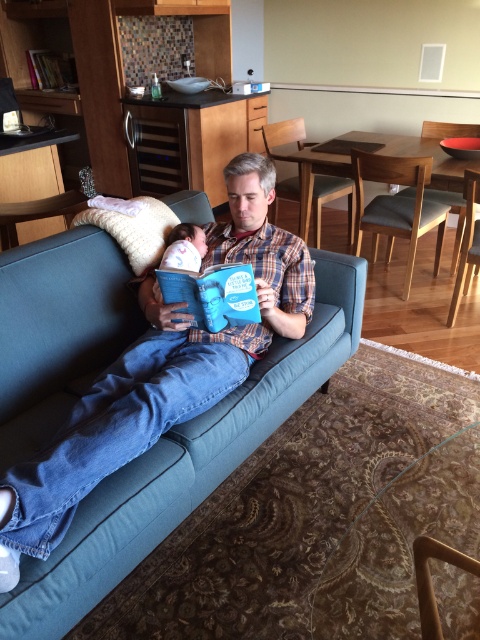
Question: Which object is the closest to the white soft baby at center?

Choices:
 (A) blue fabric couch at center
 (B) fluffy white pillow at center
 (C) hardcover book at center

Answer: (B)

Question: Among these points, which one is nearest to the camera?

Choices:
 (A) (12, 410)
 (B) (224, 304)

Answer: (A)

Question: Does hardcover book at center come behind fluffy white pillow at center?

Choices:
 (A) yes
 (B) no

Answer: (B)

Question: Is fluffy white pillow at center thinner than white soft baby at center?

Choices:
 (A) yes
 (B) no

Answer: (B)

Question: Is blue fabric couch at center to the right of white soft baby at center from the viewer's perspective?

Choices:
 (A) yes
 (B) no

Answer: (A)

Question: Estimate the real-world distances between objects in this image. Which object is farther from the hardcover book at center?

Choices:
 (A) fluffy white pillow at center
 (B) white soft baby at center

Answer: (A)